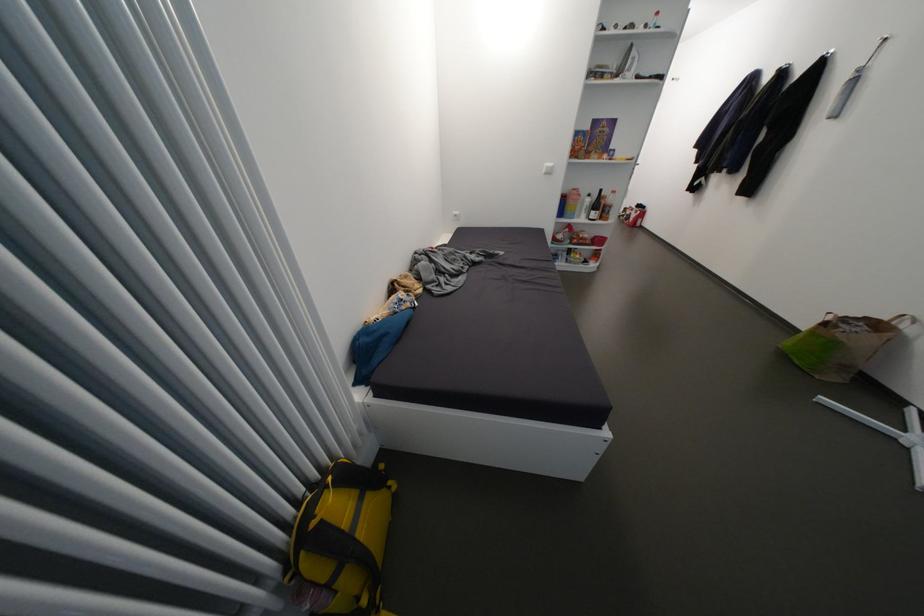
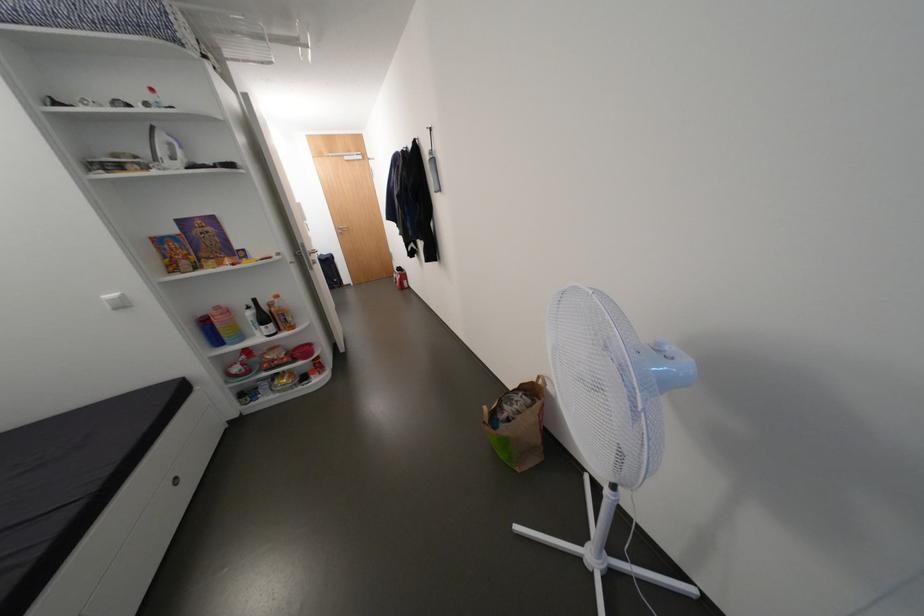
Locate, in the second image, the point that corresponds to (591,203) in the first image.

(252, 318)